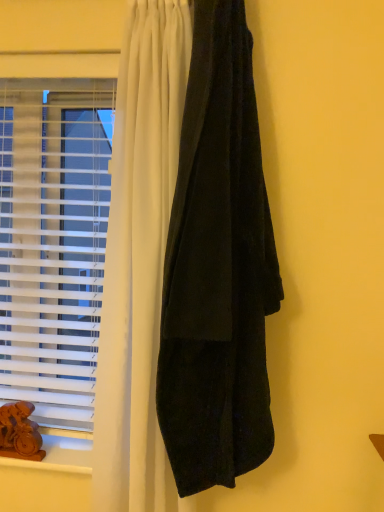
Question: Should I look upward or downward to see white plastic blinds at left?

Choices:
 (A) down
 (B) up

Answer: (B)

Question: Does brown wooden animal at lower left have a larger size compared to velvet black curtain at right?

Choices:
 (A) no
 (B) yes

Answer: (A)

Question: Considering the relative positions of brown wooden animal at lower left and velvet black curtain at right in the image provided, is brown wooden animal at lower left to the right of velvet black curtain at right from the viewer's perspective?

Choices:
 (A) no
 (B) yes

Answer: (A)

Question: Is there a large distance between brown wooden animal at lower left and velvet black curtain at right?

Choices:
 (A) yes
 (B) no

Answer: (B)

Question: Could you tell me if brown wooden animal at lower left is turned towards velvet black curtain at right?

Choices:
 (A) yes
 (B) no

Answer: (B)

Question: Considering the relative sizes of brown wooden animal at lower left and velvet black curtain at right in the image provided, is brown wooden animal at lower left smaller than velvet black curtain at right?

Choices:
 (A) yes
 (B) no

Answer: (A)

Question: Does brown wooden animal at lower left come in front of velvet black curtain at right?

Choices:
 (A) no
 (B) yes

Answer: (A)

Question: Is the position of velvet black curtain at right more distant than that of brown wooden animal at lower left?

Choices:
 (A) no
 (B) yes

Answer: (A)

Question: Is velvet black curtain at right oriented away from brown wooden animal at lower left?

Choices:
 (A) yes
 (B) no

Answer: (B)

Question: Can you confirm if velvet black curtain at right is positioned to the right of brown wooden animal at lower left?

Choices:
 (A) yes
 (B) no

Answer: (A)

Question: From the image's perspective, does velvet black curtain at right appear higher than brown wooden animal at lower left?

Choices:
 (A) yes
 (B) no

Answer: (A)

Question: Can you confirm if velvet black curtain at right is bigger than brown wooden animal at lower left?

Choices:
 (A) no
 (B) yes

Answer: (B)

Question: Does velvet black curtain at right appear on the left side of brown wooden animal at lower left?

Choices:
 (A) no
 (B) yes

Answer: (A)

Question: From a real-world perspective, does wooden at lower left sit lower than velvet black curtain at right?

Choices:
 (A) yes
 (B) no

Answer: (A)